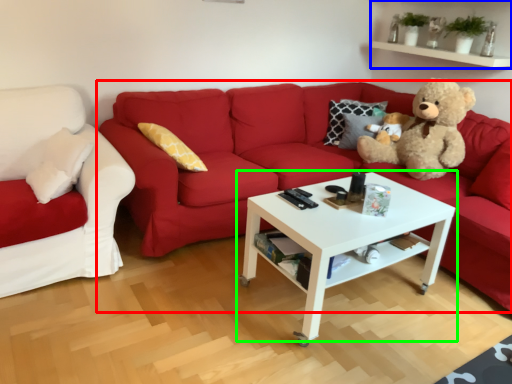
Question: Based on their relative distances, which object is farther from studio couch (highlighted by a red box)? Choose from shelf (highlighted by a blue box) and coffee table (highlighted by a green box).

Choices:
 (A) shelf
 (B) coffee table

Answer: (A)